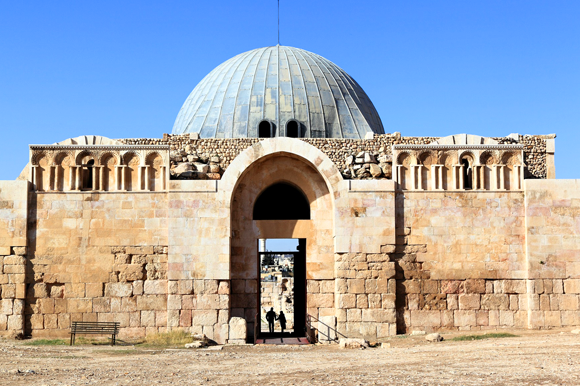
What are the coordinates of `archway` in the screenshot? It's located at (288, 169).